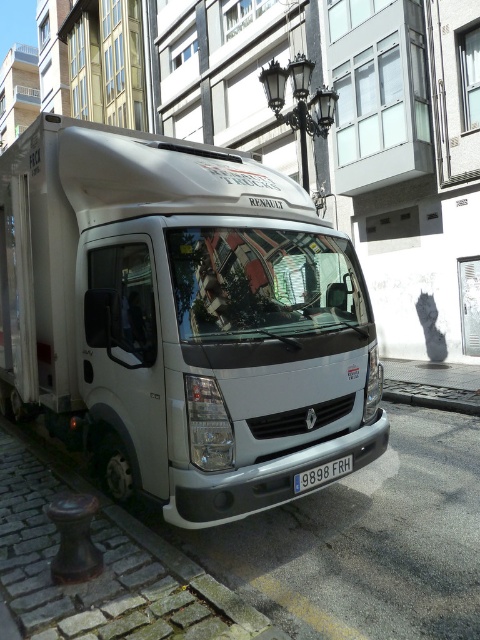
You are a delivery driver who needs to park your white matte truck at center in a spot marked by the brown concrete curb at lower left. Based on the scene, can your truck fit within the curb? Explain your reasoning.

The white matte truck at center is wider than the brown concrete curb at lower left, so it cannot fit within the curb.

You are a delivery driver who needs to park your white matte truck at center in a narrow alley. The alley is only as wide as the white plastic license plate at center. Can your truck fit into the alley?

The white matte truck at center might be wider than the white plastic license plate at center, so it may not fit into the alley if the alley is only as wide as the license plate.

You are a delivery driver who needs to park your white matte truck at center in a specific spot. The parking area requires vehicles to be within the coordinates between 0.4 and 0.5 on the x and y axes. Is your truck within the required parking area?

The white matte truck at center is located at point (181, 317), which falls within the x and y coordinates between 0.4 and 0.5. Therefore, the truck is within the required parking area.